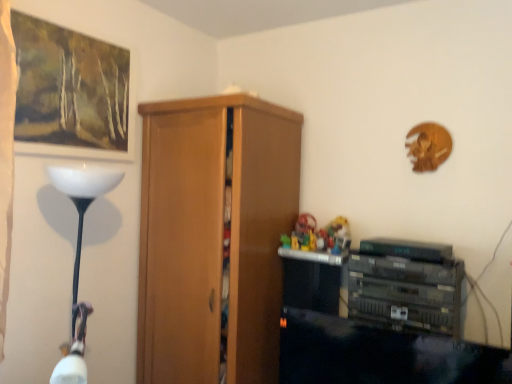
Question: Considering the relative positions of wooden cupboard at center and multicolored plastic toys at center in the image provided, is wooden cupboard at center to the left or to the right of multicolored plastic toys at center?

Choices:
 (A) left
 (B) right

Answer: (A)

Question: In terms of width, does wooden cupboard at center look wider or thinner when compared to multicolored plastic toys at center?

Choices:
 (A) wide
 (B) thin

Answer: (A)

Question: Considering the real-world distances, which object is farthest from the wooden cupboard at center?

Choices:
 (A) multicolored plastic toys at center
 (B) matte wooden picture frame at upper left

Answer: (B)

Question: Which is farther from the multicolored plastic toys at center?

Choices:
 (A) matte wooden picture frame at upper left
 (B) wooden cupboard at center

Answer: (A)